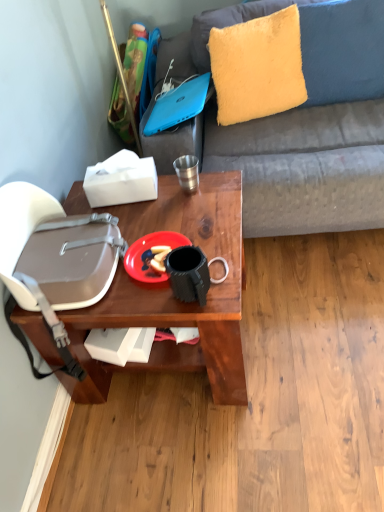
Question: Is the depth of metallic silver cup at center less than that of blue matte laptop at upper center?

Choices:
 (A) yes
 (B) no

Answer: (A)

Question: Is metallic silver cup at center to the left of blue matte laptop at upper center from the viewer's perspective?

Choices:
 (A) yes
 (B) no

Answer: (B)

Question: From a real-world perspective, is metallic silver cup at center on blue matte laptop at upper center?

Choices:
 (A) yes
 (B) no

Answer: (B)

Question: Is metallic silver cup at center positioned beyond the bounds of blue matte laptop at upper center?

Choices:
 (A) yes
 (B) no

Answer: (A)

Question: Is the position of metallic silver cup at center more distant than that of blue matte laptop at upper center?

Choices:
 (A) yes
 (B) no

Answer: (B)

Question: In terms of size, does matte gray handbag at left appear bigger or smaller than wooden table at center?

Choices:
 (A) big
 (B) small

Answer: (B)

Question: From a real-world perspective, is matte gray handbag at left physically located above or below wooden table at center?

Choices:
 (A) above
 (B) below

Answer: (A)

Question: In terms of height, does matte gray handbag at left look taller or shorter compared to wooden table at center?

Choices:
 (A) tall
 (B) short

Answer: (A)

Question: In terms of width, does matte gray handbag at left look wider or thinner when compared to wooden table at center?

Choices:
 (A) wide
 (B) thin

Answer: (B)

Question: From their relative heights in the image, would you say metallic silver cup at center is taller or shorter than wooden table at center?

Choices:
 (A) short
 (B) tall

Answer: (A)

Question: From the image's perspective, is metallic silver cup at center above or below wooden table at center?

Choices:
 (A) below
 (B) above

Answer: (B)

Question: Looking at the image, does metallic silver cup at center seem bigger or smaller compared to wooden table at center?

Choices:
 (A) big
 (B) small

Answer: (B)

Question: Does point (183, 174) appear closer or farther from the camera than point (160, 287)?

Choices:
 (A) closer
 (B) farther

Answer: (B)

Question: Considering their positions, is blue matte laptop at upper center located in front of or behind fuzzy yellow pillow at upper right?

Choices:
 (A) front
 (B) behind

Answer: (A)

Question: In terms of height, does blue matte laptop at upper center look taller or shorter compared to fuzzy yellow pillow at upper right?

Choices:
 (A) tall
 (B) short

Answer: (B)